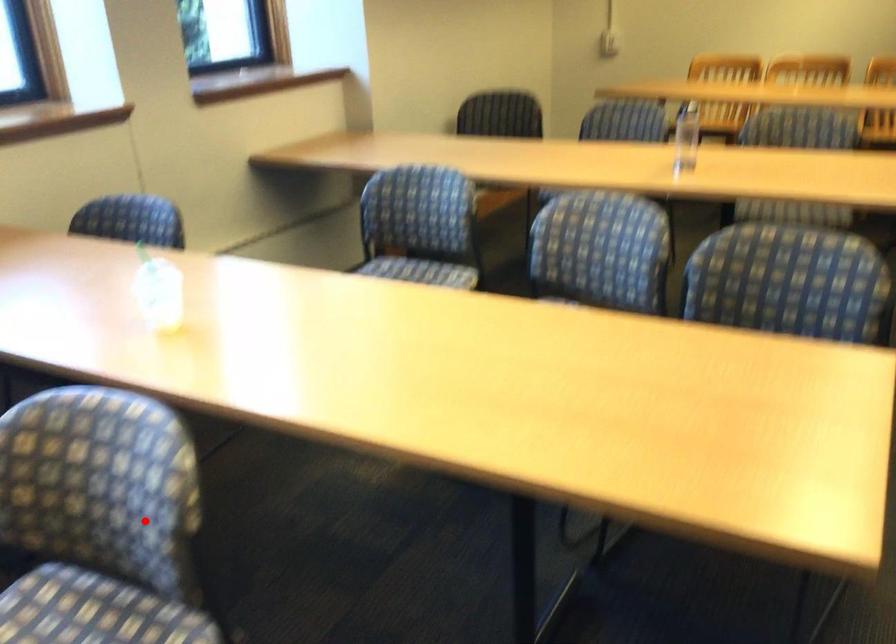
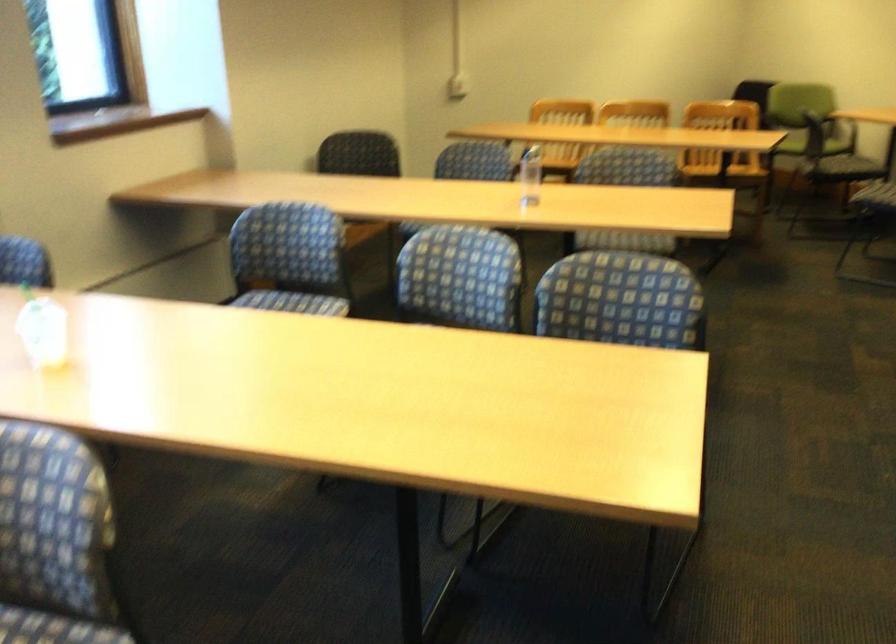
Find the pixel in the second image that matches the highlighted location in the first image.

(54, 540)